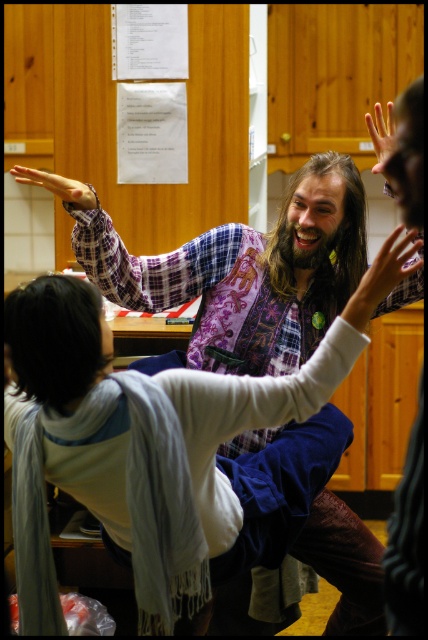
Question: Does white matte arm at center lie in front of dark brown hair at upper left?

Choices:
 (A) yes
 (B) no

Answer: (B)

Question: Among these objects, which one is nearest to the camera?

Choices:
 (A) white matte arm at center
 (B) flannel shirt at center
 (C) smooth skin hand at upper left

Answer: (C)

Question: Estimate the real-world distances between objects in this image. Which object is farther from the dark brown hair at upper left?

Choices:
 (A) flannel shirt at center
 (B) smooth skin hand at upper left
 (C) smooth skin hand at upper center

Answer: (C)

Question: Can you confirm if plaid fabric arm at upper center is positioned above smooth skin hand at upper center?

Choices:
 (A) no
 (B) yes

Answer: (A)

Question: Is the position of white matte arm at center less distant than that of dark brown hair at upper left?

Choices:
 (A) yes
 (B) no

Answer: (B)

Question: Which of the following is the closest to the observer?

Choices:
 (A) smooth skin hand at upper center
 (B) long brown hair at center
 (C) matte black hand at upper center
 (D) smooth skin hand at upper left

Answer: (C)